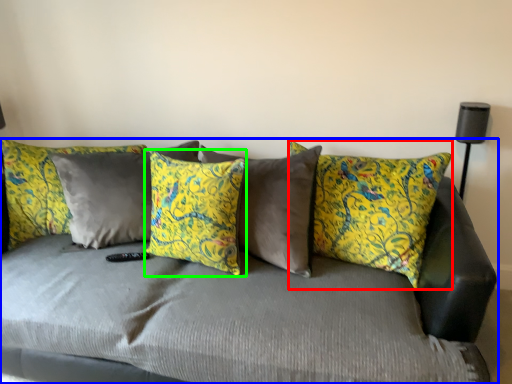
Question: Which object is positioned closest to pillow (highlighted by a red box)? Select from studio couch (highlighted by a blue box) and pillow (highlighted by a green box).

Choices:
 (A) studio couch
 (B) pillow

Answer: (A)